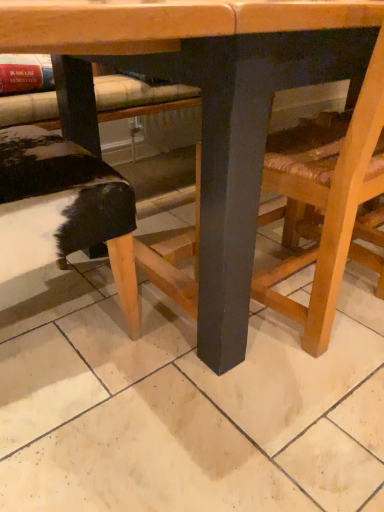
Question: Is point (347, 187) positioned closer to the camera than point (130, 287)?

Choices:
 (A) closer
 (B) farther

Answer: (A)

Question: Is wooden chair at lower right bigger or smaller than wooden table at center?

Choices:
 (A) big
 (B) small

Answer: (B)

Question: Which object is positioned farthest from the black furry cushion at lower left?

Choices:
 (A) wooden chair at lower right
 (B) wooden table at center

Answer: (A)

Question: Which is nearer to the wooden table at center?

Choices:
 (A) black furry cushion at lower left
 (B) wooden chair at lower right

Answer: (B)